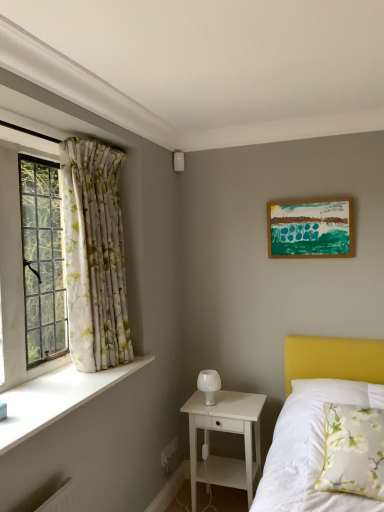
This screenshot has width=384, height=512. I want to click on free space in front of clear glass window at left, so click(38, 391).